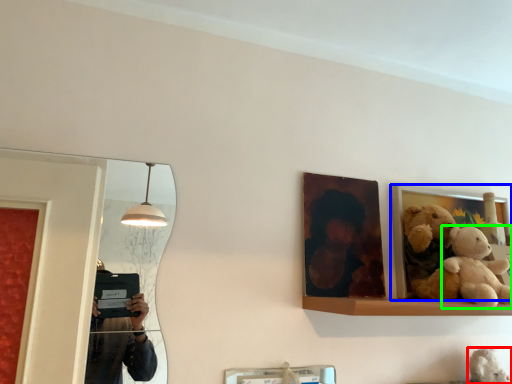
Question: Estimate the real-world distances between objects in this image. Which object is closer to teddy (highlighted by a red box), picture frame (highlighted by a blue box) or teddy bear (highlighted by a green box)?

Choices:
 (A) picture frame
 (B) teddy bear

Answer: (B)